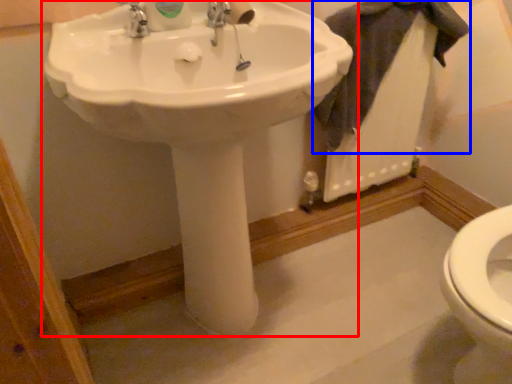
Question: Which object is further to the camera taking this photo, sink (highlighted by a red box) or bath towel (highlighted by a blue box)?

Choices:
 (A) sink
 (B) bath towel

Answer: (B)